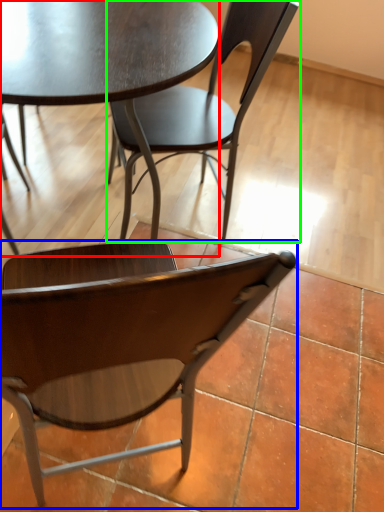
Question: Estimate the real-world distances between objects in this image. Which object is farther from coffee table (highlighted by a red box), chair (highlighted by a blue box) or chair (highlighted by a green box)?

Choices:
 (A) chair
 (B) chair

Answer: (A)